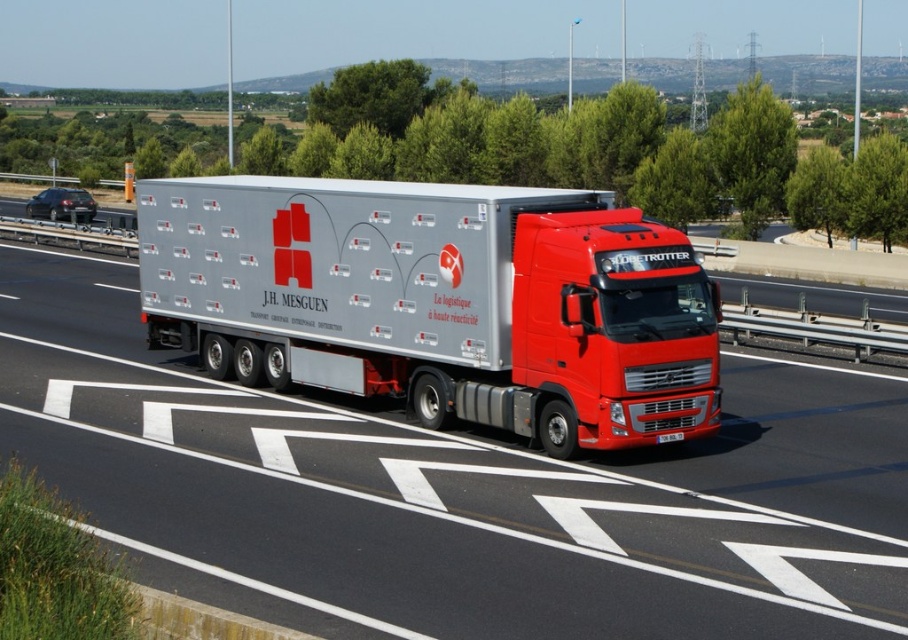
Is point (732, 467) more distant than point (349, 348)?

That is False.

Who is positioned more to the left, silver metallic truck at center or silver metallic trailer truck at center?

Positioned to the left is silver metallic truck at center.

Which is behind, point (232, 502) or point (151, 246)?

Positioned behind is point (151, 246).

You are a GUI agent. You are given a task and a screenshot of the screen. Output one action in this format:
    pyautogui.click(x=<x>, y=<y>)
    Task: Click on the silver metallic truck at center
    
    Given the screenshot: What is the action you would take?
    pyautogui.click(x=459, y=490)